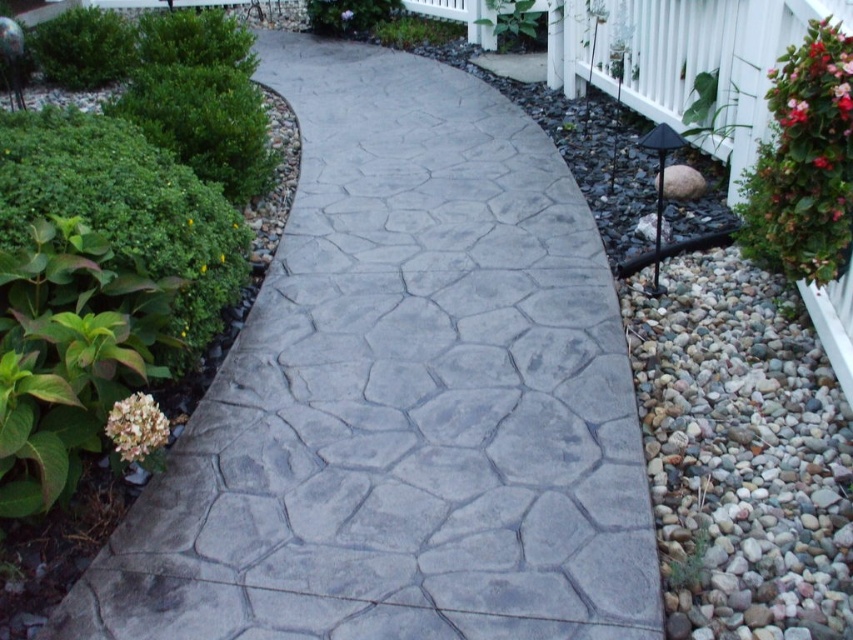
You are a gardener standing at the start of the garden pathway. You need to place a new decorative statue between the green leafy bush at upper left and the red matte flower at upper right. Based on their positions, which side of the statue should face the pathway?

The statue should be placed between the green leafy bush at upper left and the red matte flower at upper right. Since the green leafy bush at upper left is to the left of the red matte flower at upper right, the statue should face the pathway with its front towards the center of the path between them.

You are a gardener planning to water the green leafy bush at upper right and the white matte flower at lower left. Which one should you water first if you want to start from the closest to you?

You should water the green leafy bush at upper right first because it is closer to you than the white matte flower at lower left.